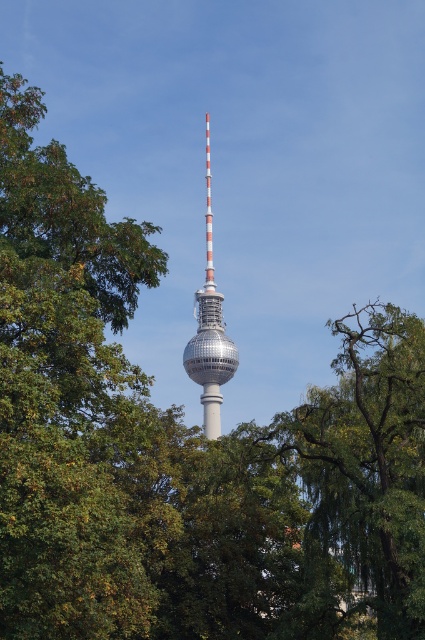
Question: Among these points, which one is nearest to the camera?

Choices:
 (A) (224, 372)
 (B) (357, 323)

Answer: (B)

Question: Can you confirm if green leafy tree at center is wider than shiny metallic tower at center?

Choices:
 (A) yes
 (B) no

Answer: (A)

Question: Among these objects, which one is nearest to the camera?

Choices:
 (A) green leafy tree at center
 (B) shiny metallic tower at center

Answer: (A)

Question: Is green leafy tree at center closer to camera compared to shiny metallic tower at center?

Choices:
 (A) no
 (B) yes

Answer: (B)

Question: Which object appears farthest from the camera in this image?

Choices:
 (A) shiny metallic tower at center
 (B) green leafy tree at center

Answer: (A)

Question: Considering the relative positions of green leafy tree at center and shiny metallic tower at center in the image provided, where is green leafy tree at center located with respect to shiny metallic tower at center?

Choices:
 (A) below
 (B) above

Answer: (A)